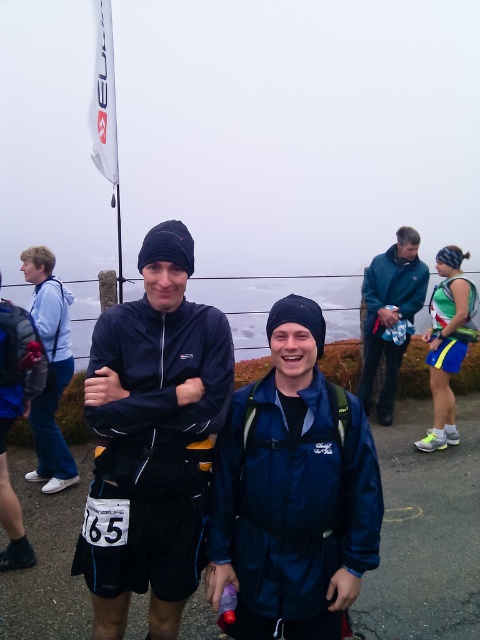
Question: Which point is closer to the camera taking this photo?

Choices:
 (A) click(x=360, y=380)
 (B) click(x=26, y=477)
 (C) click(x=317, y=600)
 (D) click(x=441, y=291)

Answer: (C)

Question: Is matte black jacket at center below teal fabric jacket at center?

Choices:
 (A) yes
 (B) no

Answer: (A)

Question: Which of these objects is positioned closest to the green fabric skirt at lower right?

Choices:
 (A) matte blue jacket at left
 (B) matte black jacket at center
 (C) teal fabric jacket at center

Answer: (C)

Question: Is teal fabric jacket at center thinner than green fabric skirt at lower right?

Choices:
 (A) no
 (B) yes

Answer: (A)

Question: Is navy blue jacket at center smaller than matte blue jacket at left?

Choices:
 (A) no
 (B) yes

Answer: (B)

Question: Estimate the real-world distances between objects in this image. Which object is farther from the matte black jacket at center?

Choices:
 (A) green fabric skirt at lower right
 (B) matte blue jacket at left

Answer: (A)